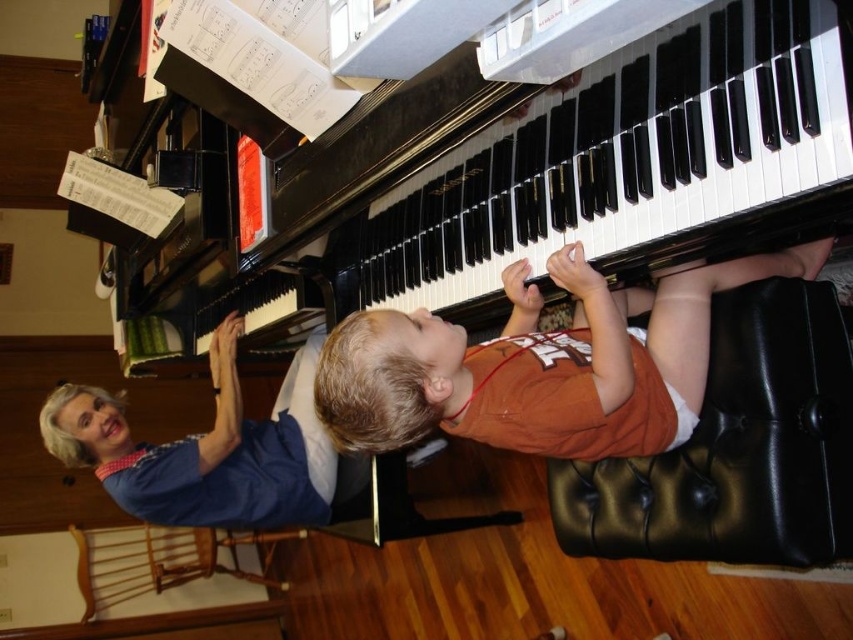
Which is in front, point (625, 161) or point (248, 483)?

Point (625, 161) is more forward.

Which is more to the right, black polished piano at center or blue fabric shirt at upper left?

From the viewer's perspective, black polished piano at center appears more on the right side.

Where is `black polished piano at center`? black polished piano at center is located at coordinates (563, 188).

Based on the photo, which is below, blue fabric shirt at upper left or wooden chair at lower left?

wooden chair at lower left is lower down.

What do you see at coordinates (206, 451) in the screenshot? The width and height of the screenshot is (853, 640). I see `blue fabric shirt at upper left` at bounding box center [206, 451].

Who is more forward, (310,376) or (120,536)?

Point (310,376)

This screenshot has width=853, height=640. Identify the location of blue fabric shirt at upper left. (206, 451).

Does orange cotton shirt at center have a smaller size compared to black leather ottoman at lower right?

Actually, orange cotton shirt at center might be larger than black leather ottoman at lower right.

Does orange cotton shirt at center have a greater width compared to black leather ottoman at lower right?

Correct, the width of orange cotton shirt at center exceeds that of black leather ottoman at lower right.

Who is more distant from viewer, (547, 374) or (839, 504)?

The point (547, 374) is more distant.

I want to click on orange cotton shirt at center, so click(x=541, y=364).